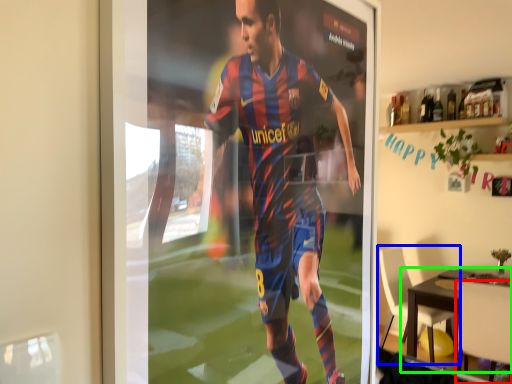
Question: Which object is the farthest from chair (highlighted by a red box)? Choose among these: chair (highlighted by a blue box) or table (highlighted by a green box).

Choices:
 (A) chair
 (B) table

Answer: (A)